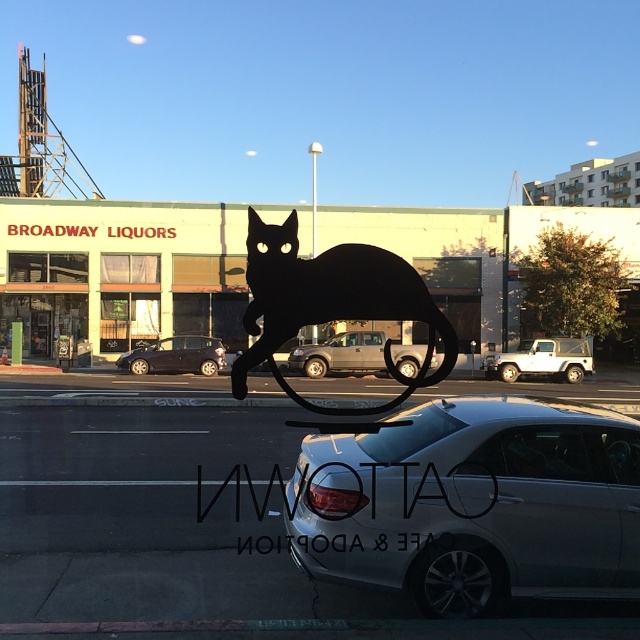
Based on the photo, who is positioned more to the left, satin silver sedan at center or dark blue matte car at center-left?

dark blue matte car at center-left

Is point (477, 602) positioned after point (186, 340)?

No, (477, 602) is in front of (186, 340).

The image size is (640, 640). Describe the element at coordinates (476, 502) in the screenshot. I see `satin silver sedan at center` at that location.

At what (x,y) coordinates should I click in order to perform the action: click on satin silver sedan at center. Please return your answer as a coordinate pair (x, y). The height and width of the screenshot is (640, 640). Looking at the image, I should click on (476, 502).

Between satin silver sedan at center and white matte suv at center, which one has less height?

With less height is satin silver sedan at center.

Can you confirm if satin silver sedan at center is smaller than white matte suv at center?

Yes.

Locate an element on the screen. This screenshot has width=640, height=640. satin silver sedan at center is located at coordinates (476, 502).

The height and width of the screenshot is (640, 640). I want to click on satin silver sedan at center, so click(x=476, y=502).

You are a GUI agent. You are given a task and a screenshot of the screen. Output one action in this format:
    pyautogui.click(x=<x>, y=<y>)
    Task: Click on the white matte suv at center
    
    Given the screenshot: What is the action you would take?
    [x=541, y=358]

Does white matte suv at center appear under dark blue matte car at center-left?

Correct, white matte suv at center is located below dark blue matte car at center-left.

Looking at this image, measure the distance between white matte suv at center and camera.

A distance of 29.87 meters exists between white matte suv at center and camera.

The width and height of the screenshot is (640, 640). I want to click on white matte suv at center, so click(541, 358).